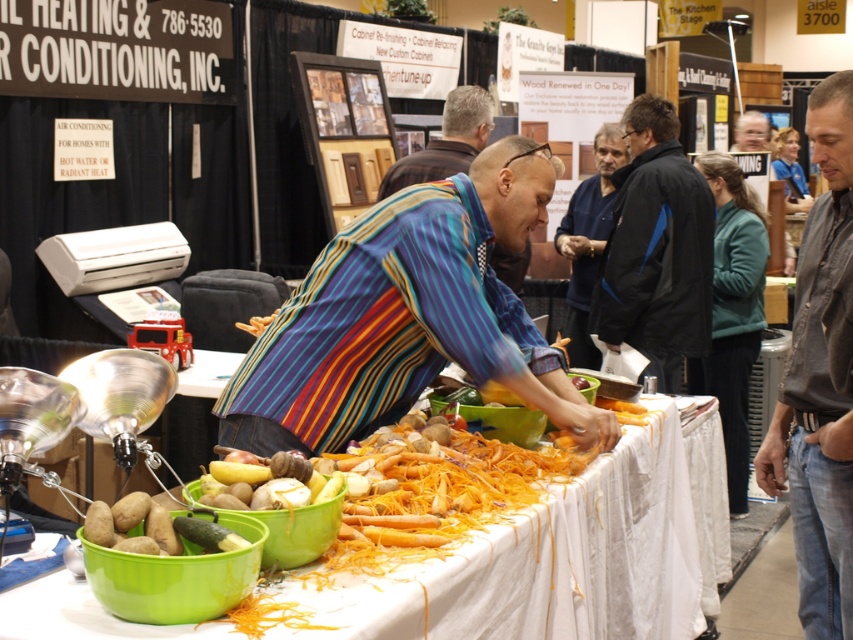
Question: Which point appears closest to the camera in this image?

Choices:
 (A) (236, 424)
 (B) (457, 109)
 (C) (814, 150)
 (D) (229, 547)

Answer: (D)

Question: Is black jacket at center in front of striped shirt at center?

Choices:
 (A) no
 (B) yes

Answer: (B)

Question: Is black jacket at center positioned behind striped shirt at center?

Choices:
 (A) yes
 (B) no

Answer: (B)

Question: Which of the following is the farthest from the observer?

Choices:
 (A) striped shirt at center
 (B) green matte cucumber at lower left
 (C) orange shredded carrots at center
 (D) black jacket at center

Answer: (A)

Question: Does brown leather jacket at lower right have a smaller size compared to green matte cucumber at lower left?

Choices:
 (A) no
 (B) yes

Answer: (A)

Question: Which is farther from the green matte cucumber at lower left?

Choices:
 (A) brown leather jacket at lower right
 (B) orange shredded carrots at center
 (C) dark blue sweater at center

Answer: (C)